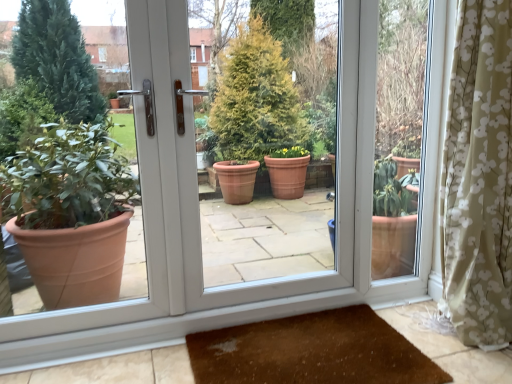
I want to click on brown textured mat at lower center, so click(311, 352).

What do you see at coordinates (311, 352) in the screenshot?
I see `brown textured mat at lower center` at bounding box center [311, 352].

Identify the location of brown textured mat at lower center. The image size is (512, 384). (311, 352).